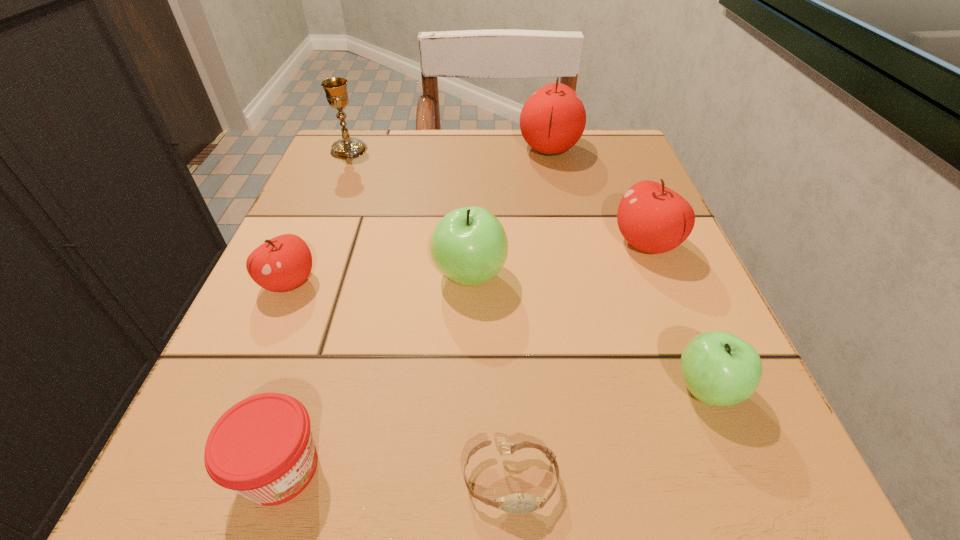
Locate an element on the screen. apple situated at the far edge is located at coordinates (552, 120).

This screenshot has height=540, width=960. In order to click on chalice at the far edge in this screenshot , I will do `click(335, 88)`.

Find the location of a particular element. Image resolution: width=960 pixels, height=540 pixels. jam located at the near edge is located at coordinates (262, 448).

Where is `watch that is positioned at the near edge`? The height and width of the screenshot is (540, 960). watch that is positioned at the near edge is located at coordinates (520, 503).

Image resolution: width=960 pixels, height=540 pixels. What are the coordinates of `chalice that is at the left edge` in the screenshot? It's located at (335, 88).

Where is `apple that is at the left edge`? apple that is at the left edge is located at coordinates (283, 263).

Where is `jam situated at the left edge`? jam situated at the left edge is located at coordinates (262, 448).

Image resolution: width=960 pixels, height=540 pixels. In order to click on object that is at the far left corner in this screenshot , I will do `click(335, 88)`.

Find the location of a particular element. Image resolution: width=960 pixels, height=540 pixels. object that is at the near left corner is located at coordinates (262, 448).

At what (x,y) coordinates should I click in order to perform the action: click on object that is at the far right corner. Please return your answer as a coordinate pair (x, y). Looking at the image, I should click on (552, 120).